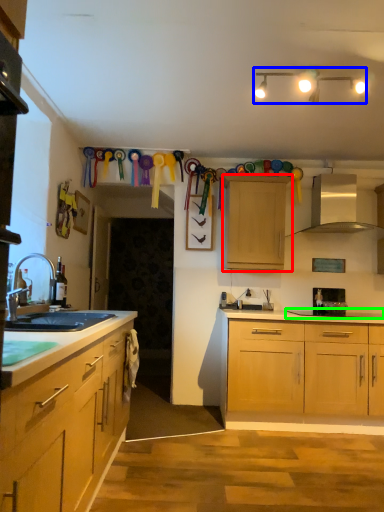
Question: Estimate the real-world distances between objects in this image. Which object is farther from cabinetry (highlighted by a red box), lamp (highlighted by a blue box) or gas stove (highlighted by a green box)?

Choices:
 (A) lamp
 (B) gas stove

Answer: (A)